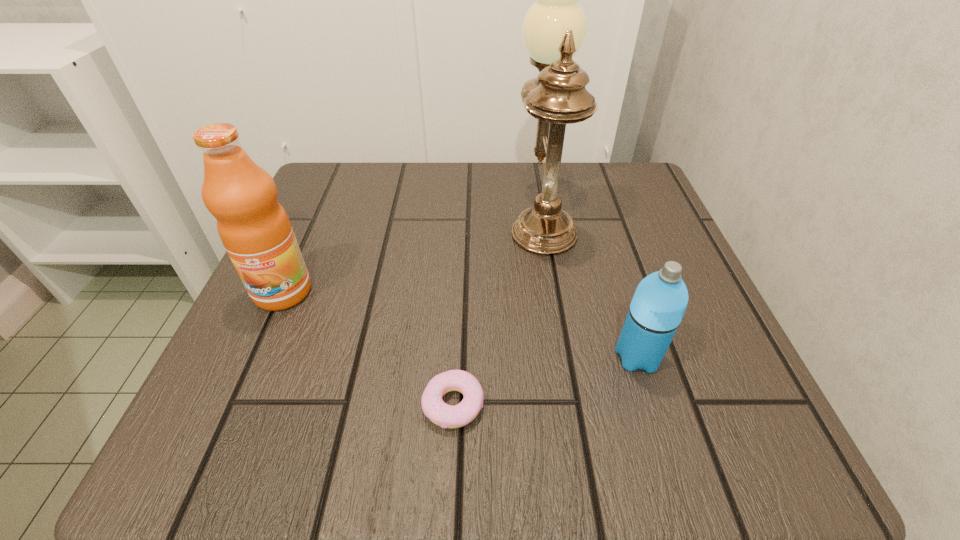
The width and height of the screenshot is (960, 540). In order to click on the third object from left to right in this screenshot , I will do `click(554, 29)`.

You are a GUI agent. You are given a task and a screenshot of the screen. Output one action in this format:
    pyautogui.click(x=<x>, y=<y>)
    Task: Click on the farthest object
    
    Given the screenshot: What is the action you would take?
    pyautogui.click(x=554, y=29)

What are the coordinates of `fruit juice` in the screenshot? It's located at (253, 226).

Image resolution: width=960 pixels, height=540 pixels. I want to click on the leftmost object, so click(x=253, y=226).

Identify the location of the third tallest object. This screenshot has height=540, width=960. (660, 300).

Find the location of a particular element. thermos bottle is located at coordinates (660, 300).

I want to click on the third object from right to left, so click(435, 409).

Locate an element on the screen. doughnut is located at coordinates (435, 409).

Image resolution: width=960 pixels, height=540 pixels. What are the coordinates of `vacant region located on the left of the oil lamp` in the screenshot? It's located at (318, 214).

Locate an element on the screen. Image resolution: width=960 pixels, height=540 pixels. vacant space positioned on the label side of the third nearest object is located at coordinates (213, 447).